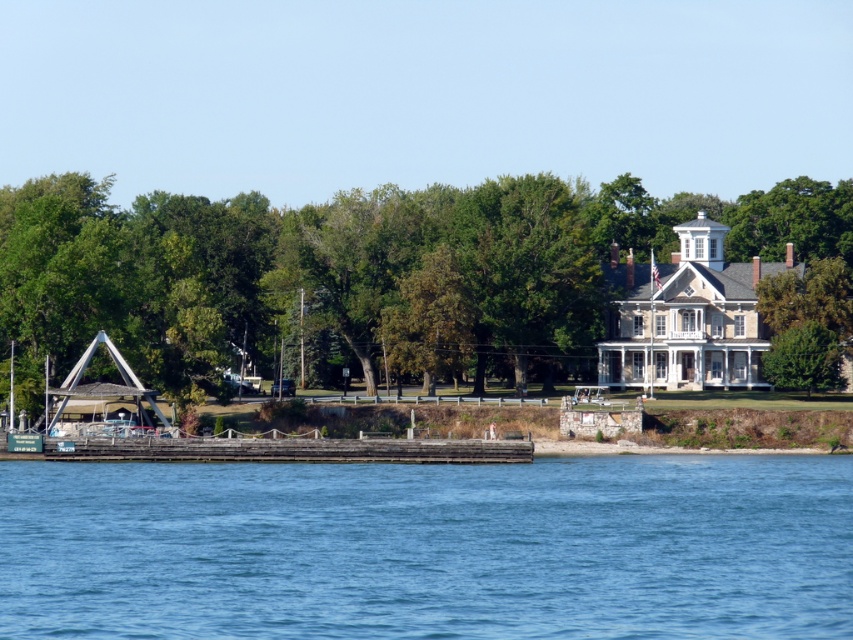
Question: Does blue water at lower center appear over green leafy tree at center?

Choices:
 (A) no
 (B) yes

Answer: (A)

Question: Which point appears farthest from the camera in this image?

Choices:
 (A) [817, 336]
 (B) [300, 460]

Answer: (A)

Question: Estimate the real-world distances between objects in this image. Which object is closer to the green leafy tree at center?

Choices:
 (A) green leafy tree at upper center
 (B) blue water at lower center

Answer: (A)

Question: Can you confirm if blue water at lower center is positioned to the right of green leafy tree at center?

Choices:
 (A) no
 (B) yes

Answer: (A)

Question: Is blue water at lower center closer to camera compared to green leafy tree at center?

Choices:
 (A) yes
 (B) no

Answer: (A)

Question: Which point appears farthest from the camera in this image?

Choices:
 (A) (440, 332)
 (B) (509, 456)
 (C) (790, 376)

Answer: (A)